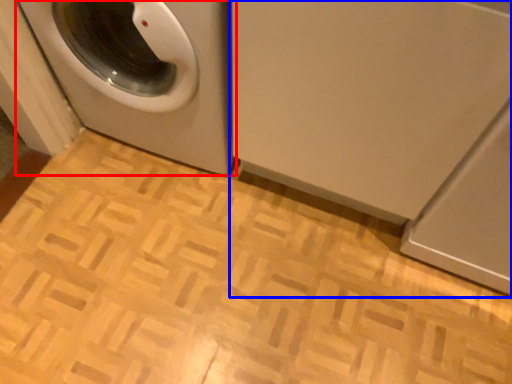
Question: Which object is closer to the camera taking this photo, washing machine (highlighted by a red box) or washing machine (highlighted by a blue box)?

Choices:
 (A) washing machine
 (B) washing machine

Answer: (B)